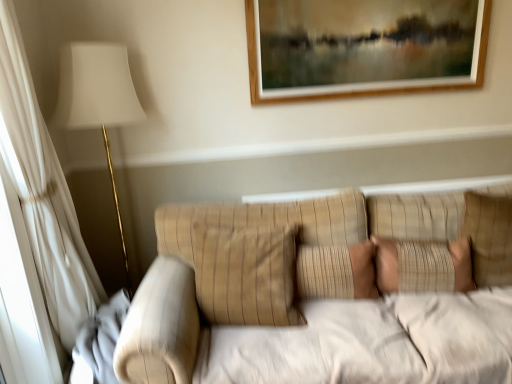
Question: From a real-world perspective, is beige textured pillow at center, arranged as the second pillow when viewed from the left, over beige striped pillow at center, positioned as the third pillow in right-to-left order?

Choices:
 (A) yes
 (B) no

Answer: (B)

Question: Is beige textured pillow at center, which is counted as the 2th pillow, starting from the right, positioned with its back to beige striped pillow at center, positioned as the third pillow in right-to-left order?

Choices:
 (A) yes
 (B) no

Answer: (B)

Question: Can you confirm if beige textured pillow at center, which is counted as the 2th pillow, starting from the right, is thinner than beige striped pillow at center, positioned as the third pillow in right-to-left order?

Choices:
 (A) no
 (B) yes

Answer: (B)

Question: Could you tell me if beige textured pillow at center, arranged as the second pillow when viewed from the left, is turned towards beige striped pillow at center, positioned as the third pillow in right-to-left order?

Choices:
 (A) yes
 (B) no

Answer: (B)

Question: Is beige textured pillow at center, arranged as the second pillow when viewed from the left, surrounding beige striped pillow at center, positioned as the third pillow in right-to-left order?

Choices:
 (A) yes
 (B) no

Answer: (B)

Question: Considering their positions, is beige textured pillow at center, which is counted as the 2th pillow, starting from the right, located in front of or behind beige striped pillow at center, positioned as the third pillow in right-to-left order?

Choices:
 (A) front
 (B) behind

Answer: (B)

Question: Choose the correct answer: Is beige textured pillow at center, arranged as the second pillow when viewed from the left, inside beige striped pillow at center, positioned as the third pillow in right-to-left order, or outside it?

Choices:
 (A) inside
 (B) outside

Answer: (B)

Question: From the image's perspective, is beige textured pillow at center, arranged as the second pillow when viewed from the left, positioned above or below beige striped pillow at center, the first pillow positioned from the left?

Choices:
 (A) above
 (B) below

Answer: (B)

Question: From a real-world perspective, is beige textured pillow at center, which is counted as the 2th pillow, starting from the right, physically located above or below beige striped pillow at center, positioned as the third pillow in right-to-left order?

Choices:
 (A) below
 (B) above

Answer: (A)

Question: Relative to beige textured pillow at center, arranged as the second pillow when viewed from the left, is beige textured pillow at right, which is counted as the 1th pillow, starting from the right, in front or behind?

Choices:
 (A) front
 (B) behind

Answer: (B)

Question: Is beige textured pillow at right, which is counted as the 1th pillow, starting from the right, situated inside beige textured pillow at center, arranged as the second pillow when viewed from the left, or outside?

Choices:
 (A) outside
 (B) inside

Answer: (A)

Question: From the image's perspective, is beige textured pillow at right, acting as the 3th pillow starting from the left, positioned above or below beige textured pillow at center, arranged as the second pillow when viewed from the left?

Choices:
 (A) below
 (B) above

Answer: (B)

Question: Based on their sizes in the image, would you say beige textured pillow at right, which is counted as the 1th pillow, starting from the right, is bigger or smaller than beige textured pillow at center, which is counted as the 2th pillow, starting from the right?

Choices:
 (A) small
 (B) big

Answer: (B)

Question: Is beige striped pillow at center, positioned as the third pillow in right-to-left order, situated inside beige textured pillow at right, which is counted as the 1th pillow, starting from the right, or outside?

Choices:
 (A) outside
 (B) inside

Answer: (A)

Question: Considering the positions of beige striped pillow at center, positioned as the third pillow in right-to-left order, and beige textured pillow at right, which is counted as the 1th pillow, starting from the right, in the image, is beige striped pillow at center, positioned as the third pillow in right-to-left order, bigger or smaller than beige textured pillow at right, which is counted as the 1th pillow, starting from the right,?

Choices:
 (A) big
 (B) small

Answer: (A)